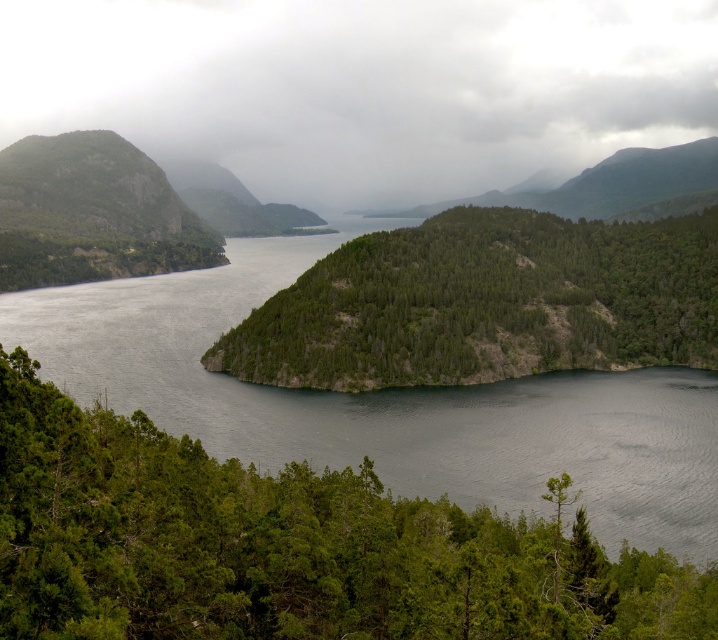
Question: Can you confirm if gray cloudy sky at upper center is positioned above green matte tree at center?

Choices:
 (A) no
 (B) yes

Answer: (B)

Question: Can you confirm if green matte tree at center is thinner than green textured hillside at center?

Choices:
 (A) yes
 (B) no

Answer: (A)

Question: Is green matte tree at center bigger than green forested mountain at upper center?

Choices:
 (A) no
 (B) yes

Answer: (A)

Question: Among these points, which one is nearest to the camera?

Choices:
 (A) (299, 93)
 (B) (19, 442)

Answer: (B)

Question: Which point is farther to the camera?

Choices:
 (A) (454, 264)
 (B) (666, 209)
 (C) (286, 116)

Answer: (C)

Question: Which of the following is the farthest from the observer?

Choices:
 (A) green textured hillside at center
 (B) gray cloudy sky at upper center
 (C) green matte tree at center

Answer: (B)